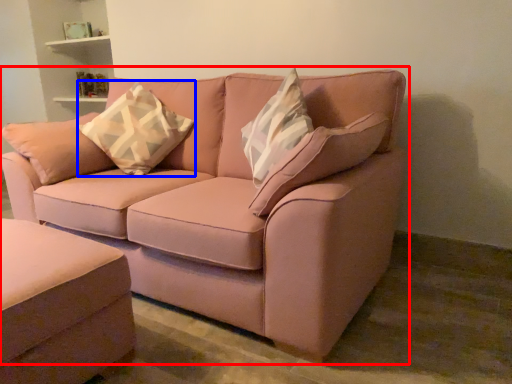
Question: Which of the following is the closest to the observer, studio couch (highlighted by a red box) or throw pillow (highlighted by a blue box)?

Choices:
 (A) studio couch
 (B) throw pillow

Answer: (A)